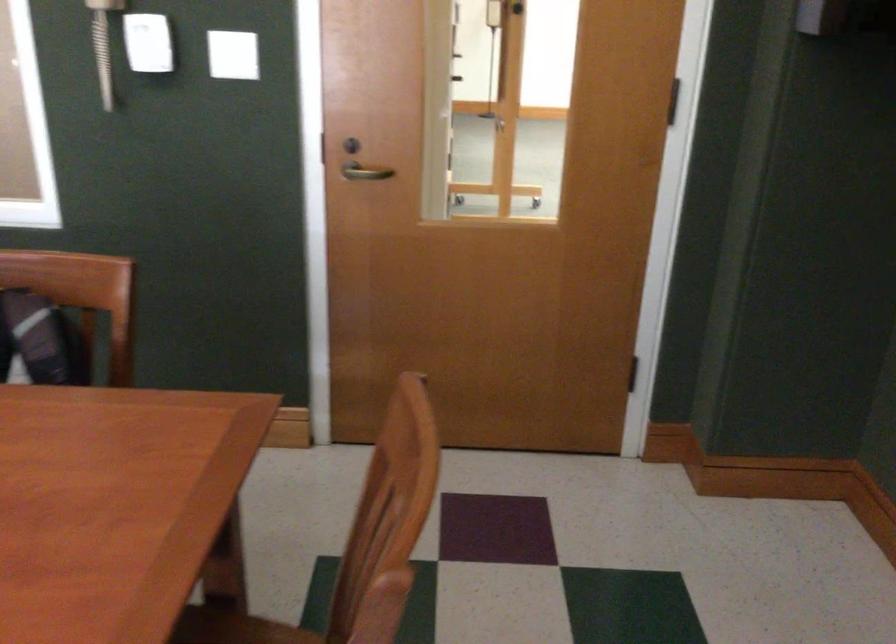
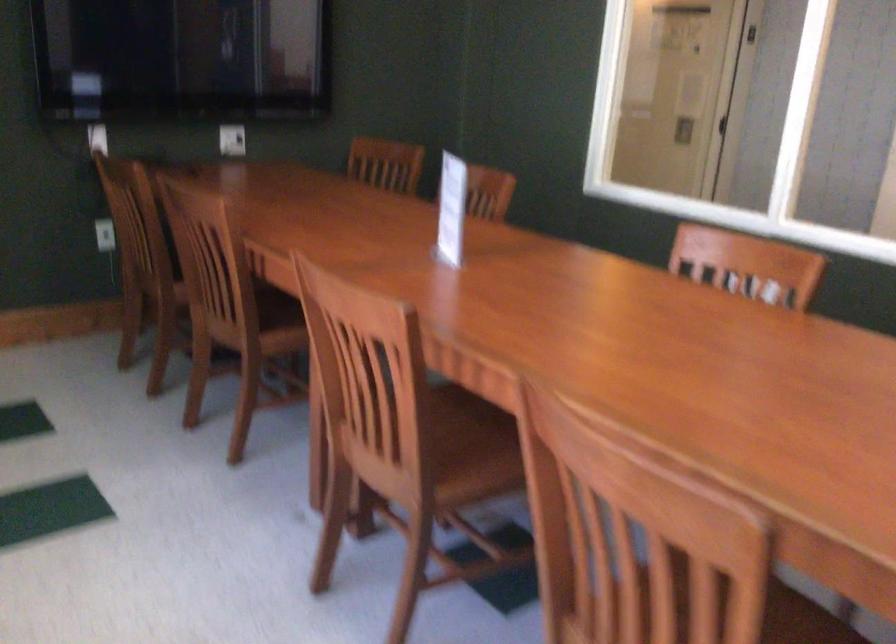
Question: How did the camera likely rotate?

Choices:
 (A) Left
 (B) Right
 (C) Up
 (D) Down

Answer: (A)